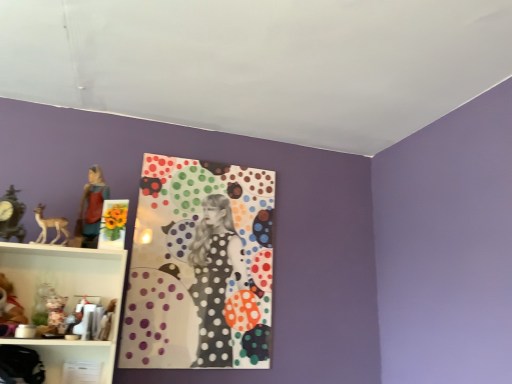
Question: Is matte brown statue at left thinner than polka dot fabric at center?

Choices:
 (A) no
 (B) yes

Answer: (A)

Question: From a real-world perspective, is matte brown statue at left positioned over polka dot fabric at center based on gravity?

Choices:
 (A) yes
 (B) no

Answer: (A)

Question: From a real-world perspective, is matte brown statue at left physically below polka dot fabric at center?

Choices:
 (A) no
 (B) yes

Answer: (A)

Question: From the image's perspective, is matte brown statue at left on top of polka dot fabric at center?

Choices:
 (A) no
 (B) yes

Answer: (B)

Question: Does matte brown statue at left have a larger size compared to polka dot fabric at center?

Choices:
 (A) no
 (B) yes

Answer: (A)

Question: Considering the positions of polka dot fabric at center and matte brown deer at left in the image, is polka dot fabric at center taller or shorter than matte brown deer at left?

Choices:
 (A) tall
 (B) short

Answer: (A)

Question: Does point (145, 263) appear closer or farther from the camera than point (66, 238)?

Choices:
 (A) closer
 (B) farther

Answer: (B)

Question: Is polka dot fabric at center spatially inside matte brown deer at left, or outside of it?

Choices:
 (A) outside
 (B) inside

Answer: (A)

Question: From the image's perspective, is polka dot fabric at center positioned above or below matte brown deer at left?

Choices:
 (A) above
 (B) below

Answer: (B)

Question: In the image, is plush teddy bear at lower left on the left side or the right side of matte brown statue at left?

Choices:
 (A) left
 (B) right

Answer: (A)

Question: Does point (0, 311) appear closer or farther from the camera than point (96, 226)?

Choices:
 (A) closer
 (B) farther

Answer: (A)

Question: From the image's perspective, is plush teddy bear at lower left above or below matte brown statue at left?

Choices:
 (A) above
 (B) below

Answer: (B)

Question: Considering their positions, is plush teddy bear at lower left located in front of or behind matte brown statue at left?

Choices:
 (A) front
 (B) behind

Answer: (A)

Question: From their relative heights in the image, would you say matte black clock at left is taller or shorter than plush teddy bear at lower left?

Choices:
 (A) short
 (B) tall

Answer: (A)

Question: Does point (8, 198) appear closer or farther from the camera than point (3, 291)?

Choices:
 (A) farther
 (B) closer

Answer: (A)